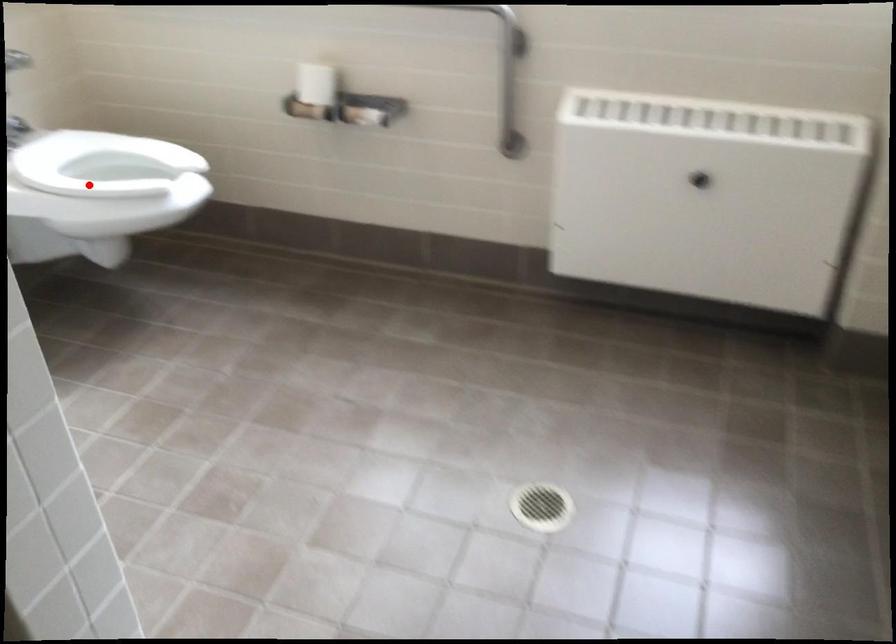
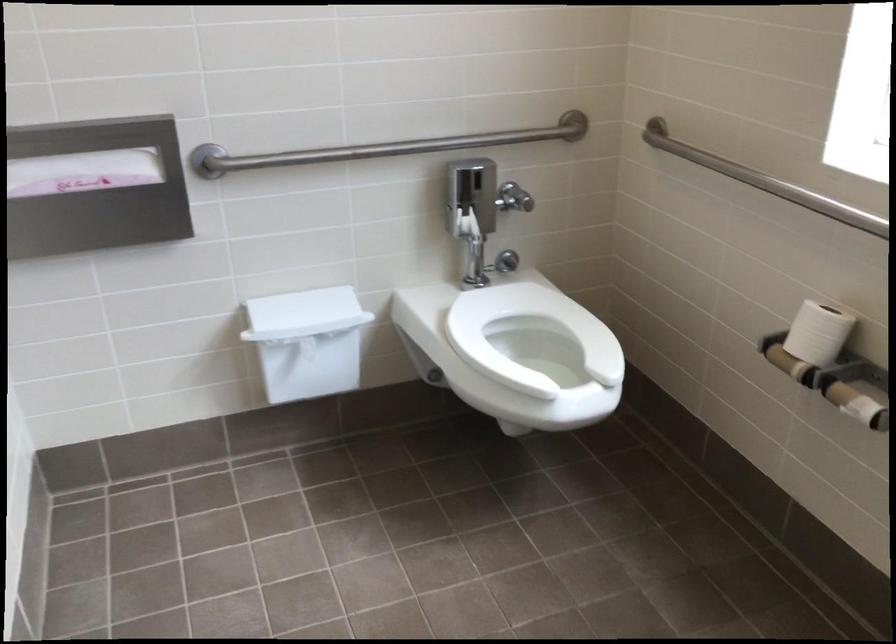
Find the pixel in the second image that matches the highlighted location in the first image.

(530, 335)